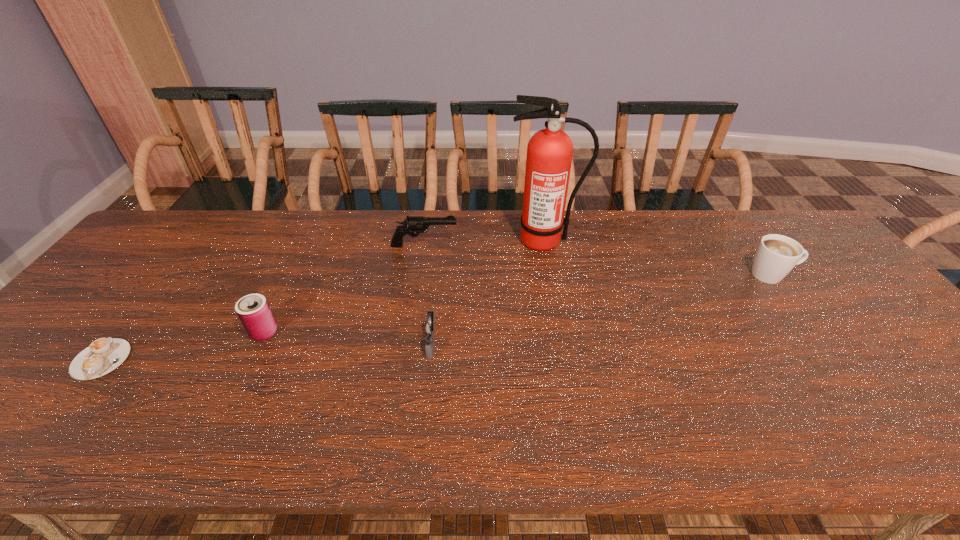
You are a GUI agent. You are given a task and a screenshot of the screen. Output one action in this format:
    pyautogui.click(x=<x>, y=<y>)
    Task: Click on the vacant area that lies between the farther cappuccino and the igniter
    The image size is (960, 540).
    Given the screenshot: What is the action you would take?
    pyautogui.click(x=602, y=309)

Find the location of a particular element. empty space between the nearer cappuccino and the can is located at coordinates (182, 346).

Locate an element on the screen. object that is the fourth closest to the igniter is located at coordinates (103, 355).

What are the coordinates of `the third closest object to the igniter` in the screenshot? It's located at (253, 310).

Identify the location of blank space that satisfies the following two spatial constraints: 1. at the end of the barrel of the igniter; 2. on the right side of the gun. (409, 343).

You are a GUI agent. You are given a task and a screenshot of the screen. Output one action in this format:
    pyautogui.click(x=<x>, y=<y>)
    Task: Click on the vacant space that satisfies the following two spatial constraints: 1. on the handle side of the fire extinguisher; 2. at the end of the barrel of the gun
    This screenshot has height=540, width=960.
    Given the screenshot: What is the action you would take?
    pyautogui.click(x=545, y=245)

Locate an element on the screen. The height and width of the screenshot is (540, 960). free space that satisfies the following two spatial constraints: 1. at the end of the barrel of the gun; 2. on the front side of the can is located at coordinates [411, 332].